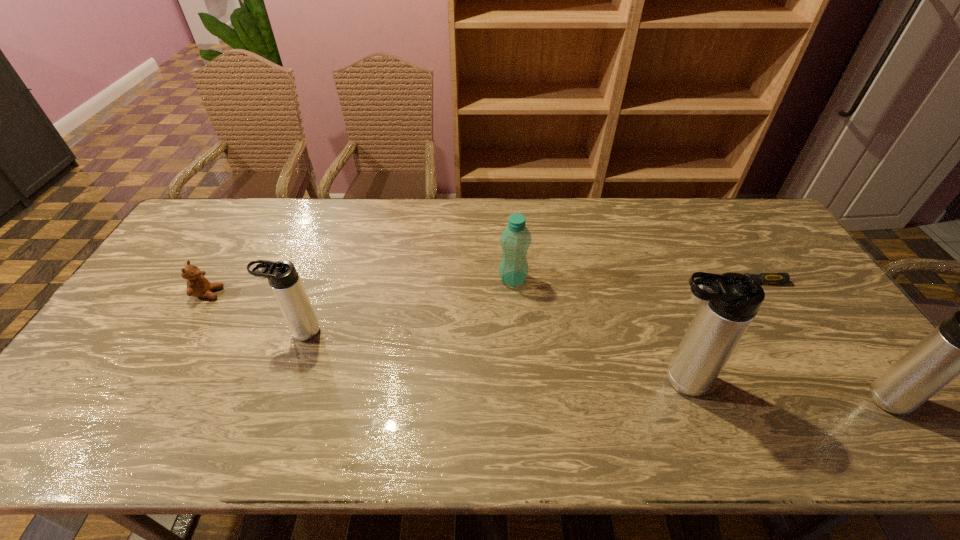
Where is `vacant space positioned 0.080m on the handle side of the leftmost thermos bottle`? The image size is (960, 540). vacant space positioned 0.080m on the handle side of the leftmost thermos bottle is located at coordinates [251, 332].

Where is `vacant region located on the handle side of the leftmost thermos bottle`? The image size is (960, 540). vacant region located on the handle side of the leftmost thermos bottle is located at coordinates (203, 332).

Identify the location of vacant space located on the handle side of the leftmost thermos bottle. Image resolution: width=960 pixels, height=540 pixels. (144, 332).

Find the location of a particular element. The width and height of the screenshot is (960, 540). free space located on the handle side of the second thermos bottle from right to left is located at coordinates (565, 380).

Where is `vacant space located on the handle side of the second thermos bottle from right to left`? vacant space located on the handle side of the second thermos bottle from right to left is located at coordinates (540, 380).

Identify the location of vacant space located on the handle side of the second thermos bottle from right to left. The width and height of the screenshot is (960, 540). (516, 380).

Where is `vacant space located on the right of the bottle`? Image resolution: width=960 pixels, height=540 pixels. vacant space located on the right of the bottle is located at coordinates (570, 279).

This screenshot has height=540, width=960. I want to click on free space located 0.280m insert the second object from right to left into a screw head, so click(x=614, y=282).

At what (x,y) coordinates should I click in order to perform the action: click on vacant space situated insert the second object from right to left into a screw head. Please return your answer as a coordinate pair (x, y). Looking at the image, I should click on [x=681, y=282].

The height and width of the screenshot is (540, 960). I want to click on free space located insert the second object from right to left into a screw head, so click(684, 282).